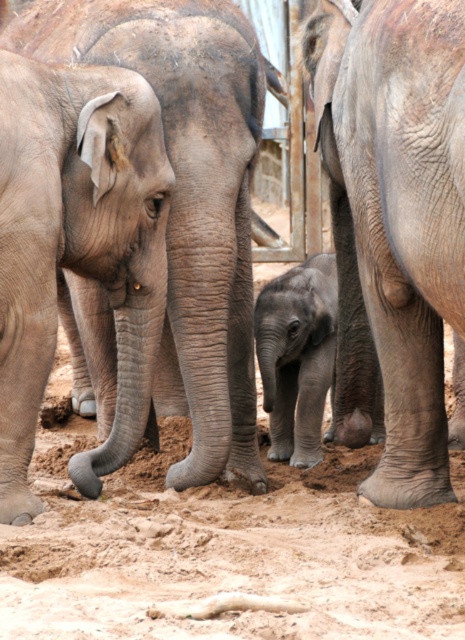
Question: Which point appears farthest from the camera in this image?

Choices:
 (A) (349, 244)
 (B) (268, 289)

Answer: (B)

Question: Is gray matte elephant at left above gray matte elephant at center?

Choices:
 (A) no
 (B) yes

Answer: (B)

Question: From the image, what is the correct spatial relationship of gray wrinkled elephant at center in relation to gray matte elephant at left?

Choices:
 (A) right
 (B) left

Answer: (A)

Question: Is gray wrinkled elephant at center thinner than gray matte elephant at left?

Choices:
 (A) yes
 (B) no

Answer: (A)

Question: Which of the following is the farthest from the observer?

Choices:
 (A) gray matte elephant at center
 (B) gray matte elephant at left

Answer: (A)

Question: Which object is positioned farthest from the gray matte elephant at center?

Choices:
 (A) gray matte elephant at left
 (B) gray wrinkled elephant at center

Answer: (A)